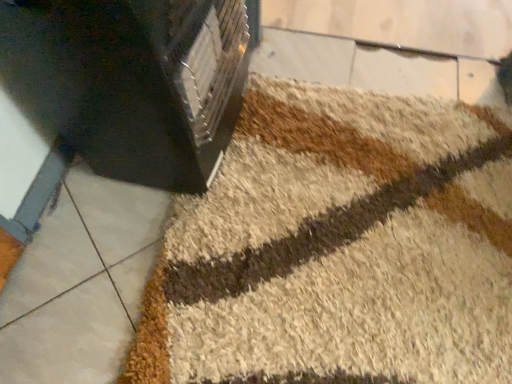
Question: Is beige shaggy bath mat at center aimed at black plastic heater at upper left?

Choices:
 (A) no
 (B) yes

Answer: (A)

Question: Is beige shaggy bath mat at center taller than black plastic heater at upper left?

Choices:
 (A) yes
 (B) no

Answer: (B)

Question: From the image's perspective, does beige shaggy bath mat at center appear lower than black plastic heater at upper left?

Choices:
 (A) no
 (B) yes

Answer: (B)

Question: Is the depth of beige shaggy bath mat at center less than that of black plastic heater at upper left?

Choices:
 (A) yes
 (B) no

Answer: (B)

Question: Is beige shaggy bath mat at center at the left side of black plastic heater at upper left?

Choices:
 (A) no
 (B) yes

Answer: (A)

Question: Would you consider beige shaggy bath mat at center to be distant from black plastic heater at upper left?

Choices:
 (A) yes
 (B) no

Answer: (B)

Question: Does black plastic heater at upper left have a greater width compared to beige shaggy bath mat at center?

Choices:
 (A) no
 (B) yes

Answer: (A)

Question: From a real-world perspective, is black plastic heater at upper left located beneath beige shaggy bath mat at center?

Choices:
 (A) yes
 (B) no

Answer: (B)

Question: Considering the relative positions of black plastic heater at upper left and beige shaggy bath mat at center in the image provided, is black plastic heater at upper left to the right of beige shaggy bath mat at center from the viewer's perspective?

Choices:
 (A) no
 (B) yes

Answer: (A)

Question: Does black plastic heater at upper left have a greater height compared to beige shaggy bath mat at center?

Choices:
 (A) no
 (B) yes

Answer: (B)

Question: Does black plastic heater at upper left have a larger size compared to beige shaggy bath mat at center?

Choices:
 (A) no
 (B) yes

Answer: (B)

Question: Is black plastic heater at upper left oriented away from beige shaggy bath mat at center?

Choices:
 (A) yes
 (B) no

Answer: (B)

Question: Is beige shaggy bath mat at center in front of or behind black plastic heater at upper left in the image?

Choices:
 (A) behind
 (B) front

Answer: (A)